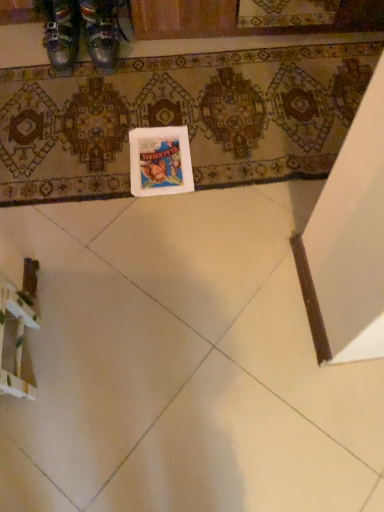
At what (x,y) coordinates should I click in order to perform the action: click on blank space situated above white matte postcard at center (from a real-world perspective). Please return your answer as a coordinate pair (x, y). The height and width of the screenshot is (512, 384). Looking at the image, I should click on (159, 157).